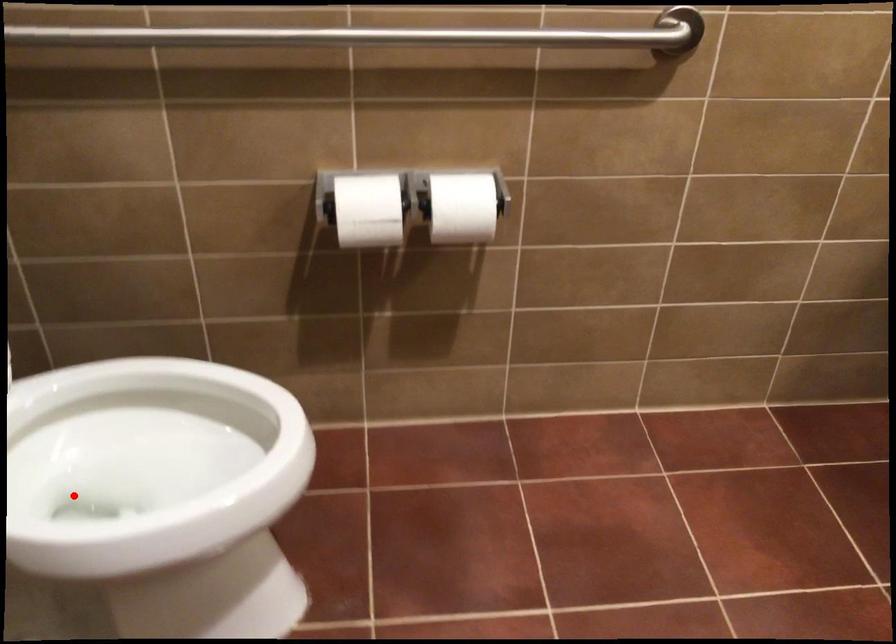
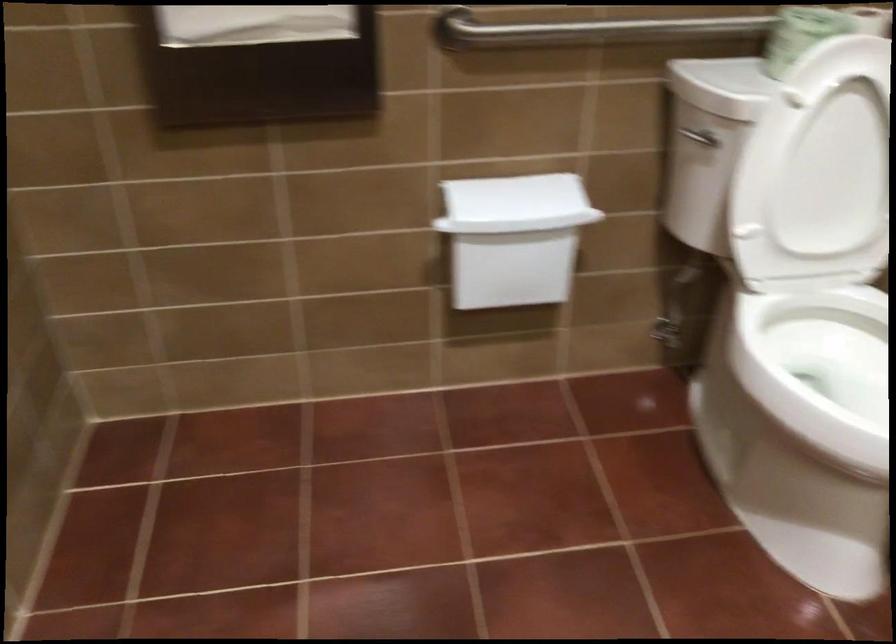
Question: I am providing you with two images of the same scene from different viewpoints. Given a red point in image1, look at the same physical point in image2. Is it:

Choices:
 (A) Closer to the viewpoint
 (B) Farther from the viewpoint

Answer: (B)